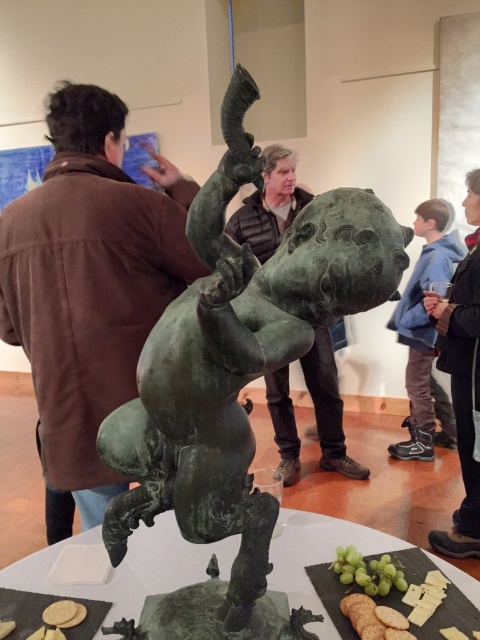
You are an artist trying to place a new sculpture in the gallery. The sculpture is 1.2 meters wide. You see the blue denim jacket at right and the white crumbly cheese at lower left. Which object is wider, and will the sculpture fit between them if placed centrally?

The blue denim jacket at right is wider than the white crumbly cheese at lower left. Since the sculpture is 1.2 meters wide and the space between them depends on their widths, but the exact distance isn not provided, we cannot confirm if it will fit. However, the blue denim jacket at right being wider may require more space. Please check the actual spacing between them.

You are an art curator organizing an exhibition. You have a blue denim jacket at right and a white crumbly cheese at lower left. Which object is placed higher in the scene?

The blue denim jacket at right is positioned over white crumbly cheese at lower left, so it is placed higher.

You are a security guard in the art gallery and need to move from the blue denim jacket at right to the white crumbly cheese at lower left. What is the shortest distance you must walk?

The shortest distance you must walk is 6.20 feet between the blue denim jacket at right and the white crumbly cheese at lower left.